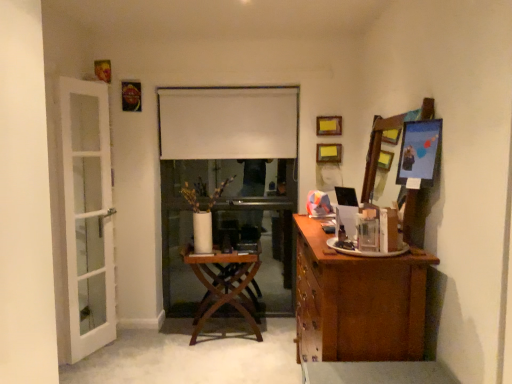
Question: Is metallic silver picture frame at upper right, the 5th picture frame from the top, oriented away from metallic gold picture frame at upper left, which is counted as the second picture frame, starting from the front?

Choices:
 (A) no
 (B) yes

Answer: (A)

Question: Could you tell me if metallic silver picture frame at upper right, which appears as the 1th picture frame when ordered from the bottom, is facing metallic gold picture frame at upper left, arranged as the 1th picture frame when viewed from the top?

Choices:
 (A) no
 (B) yes

Answer: (A)

Question: Does metallic silver picture frame at upper right, which is counted as the fifth picture frame, starting from the back, have a lesser width compared to metallic gold picture frame at upper left, arranged as the 1th picture frame when viewed from the top?

Choices:
 (A) yes
 (B) no

Answer: (B)

Question: Is the position of metallic silver picture frame at upper right, which appears as the 1th picture frame when ordered from the bottom, less distant than that of metallic gold picture frame at upper left, which is counted as the second picture frame, starting from the front?

Choices:
 (A) no
 (B) yes

Answer: (B)

Question: From a real-world perspective, is metallic silver picture frame at upper right, which appears as the 1th picture frame when ordered from the bottom, below metallic gold picture frame at upper left, marked as the fifth picture frame in a bottom-to-top arrangement?

Choices:
 (A) yes
 (B) no

Answer: (A)

Question: Considering the positions of white glass door at left and wooden table at center in the image, is white glass door at left wider or thinner than wooden table at center?

Choices:
 (A) thin
 (B) wide

Answer: (A)

Question: Would you say white glass door at left is inside or outside wooden table at center?

Choices:
 (A) outside
 (B) inside

Answer: (A)

Question: Is point (111, 168) closer or farther from the camera than point (226, 276)?

Choices:
 (A) farther
 (B) closer

Answer: (B)

Question: From a real-world perspective, is white glass door at left physically located above or below wooden table at center?

Choices:
 (A) above
 (B) below

Answer: (A)

Question: In terms of width, does brown wood cabinet at right look wider or thinner when compared to white matte curtain at center?

Choices:
 (A) wide
 (B) thin

Answer: (A)

Question: In terms of height, does brown wood cabinet at right look taller or shorter compared to white matte curtain at center?

Choices:
 (A) tall
 (B) short

Answer: (A)

Question: Is brown wood cabinet at right in front of or behind white matte curtain at center in the image?

Choices:
 (A) front
 (B) behind

Answer: (A)

Question: Visually, is brown wood cabinet at right positioned to the left or to the right of white matte curtain at center?

Choices:
 (A) right
 (B) left

Answer: (A)

Question: Considering their positions, is metallic gold picture frame at upper left, acting as the fifth picture frame starting from the right, located in front of or behind white glass door at left?

Choices:
 (A) behind
 (B) front

Answer: (A)

Question: Considering the positions of metallic gold picture frame at upper left, which appears as the first picture frame when viewed from the left, and white glass door at left in the image, is metallic gold picture frame at upper left, which appears as the first picture frame when viewed from the left, bigger or smaller than white glass door at left?

Choices:
 (A) small
 (B) big

Answer: (A)